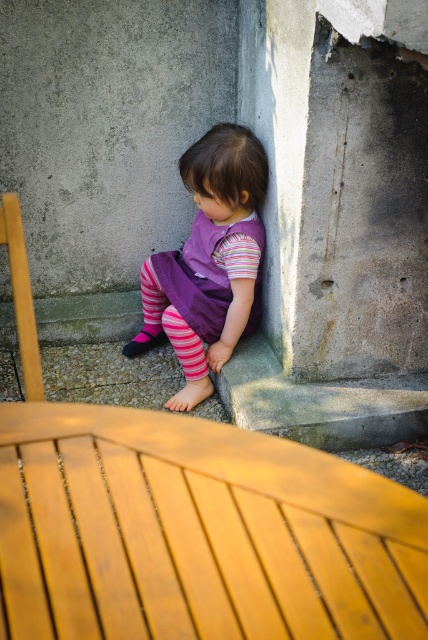
Question: Does purple cotton dress at center have a lesser width compared to pink striped sock at lower center?

Choices:
 (A) yes
 (B) no

Answer: (B)

Question: Which point is closer to the camera?

Choices:
 (A) pink striped sock at lower center
 (B) purple cotton dress at center

Answer: (A)

Question: Which object appears farthest from the camera in this image?

Choices:
 (A) purple cotton dress at center
 (B) pink striped sock at lower center

Answer: (A)

Question: Does purple fabric dress at lower center appear over pink striped sock at lower center?

Choices:
 (A) no
 (B) yes

Answer: (B)

Question: Does purple cotton dress at center have a larger size compared to pink striped sock at lower center?

Choices:
 (A) no
 (B) yes

Answer: (B)

Question: Which point is closer to the camera?

Choices:
 (A) purple cotton dress at center
 (B) purple fabric dress at lower center

Answer: (B)